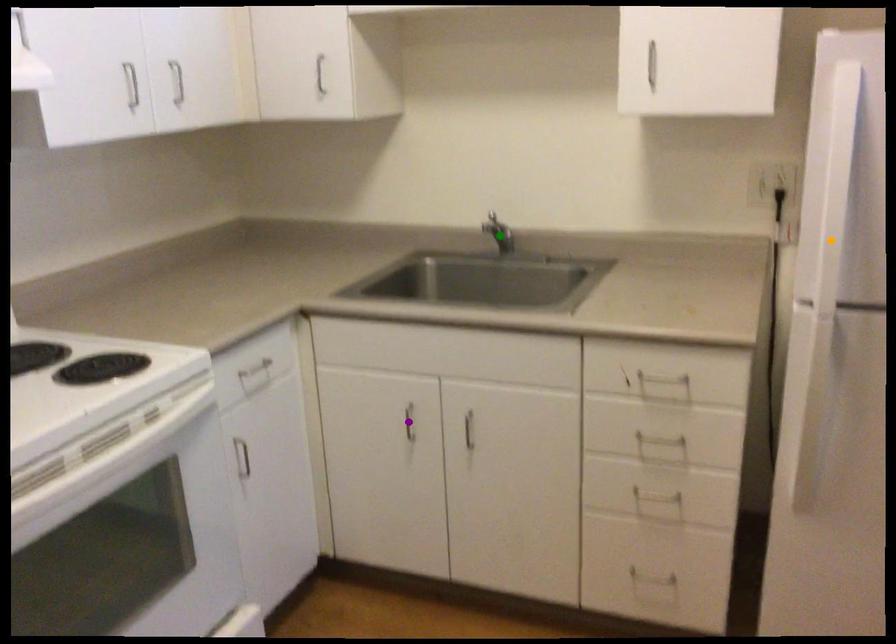
In the scene shown: Order these from nearest to farthest:
orange point, green point, purple point

orange point, purple point, green point